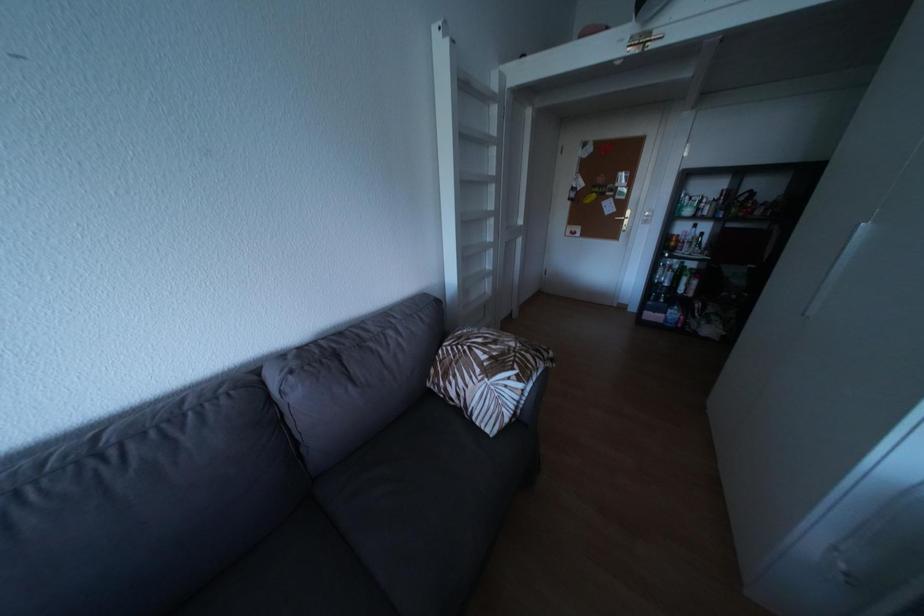
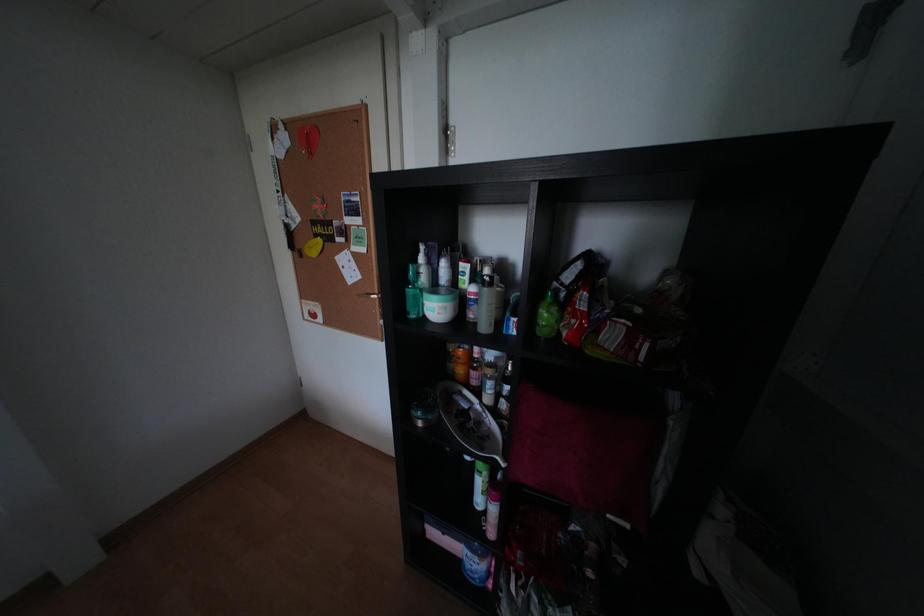
In a continuous first-person perspective shot, in which direction is the camera moving?

The cameraman walked toward right, forward.